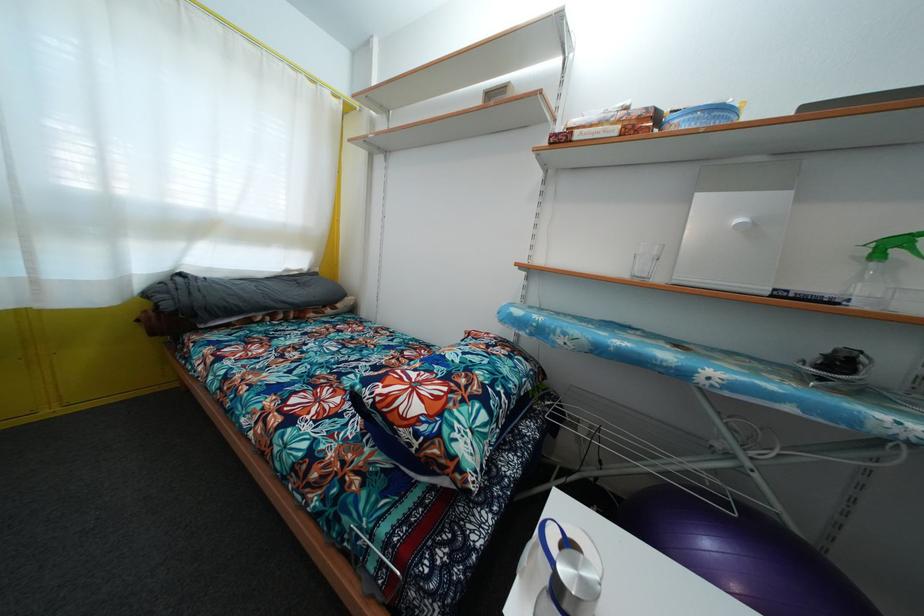
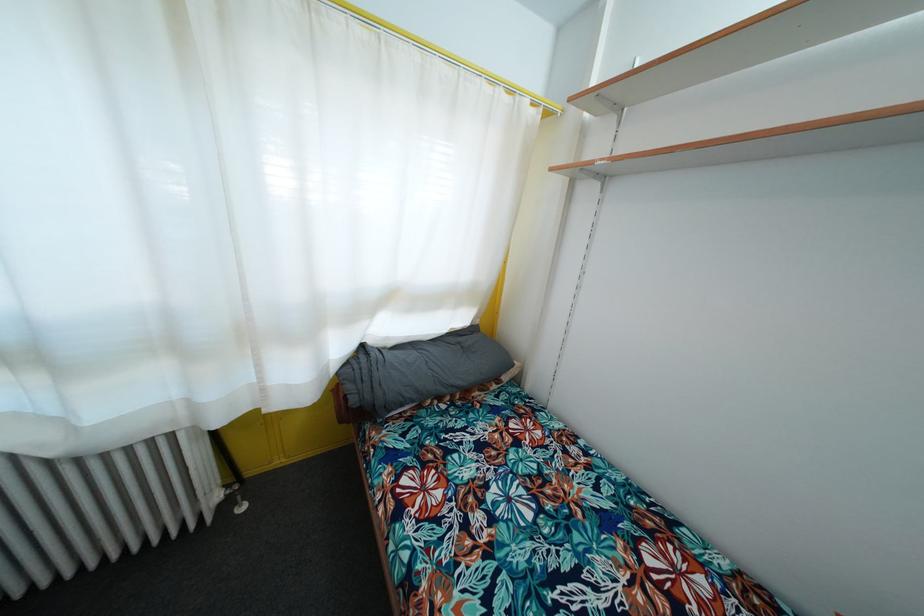
The point at (171, 312) is marked in the first image. Where is the corresponding point in the second image?

(358, 407)